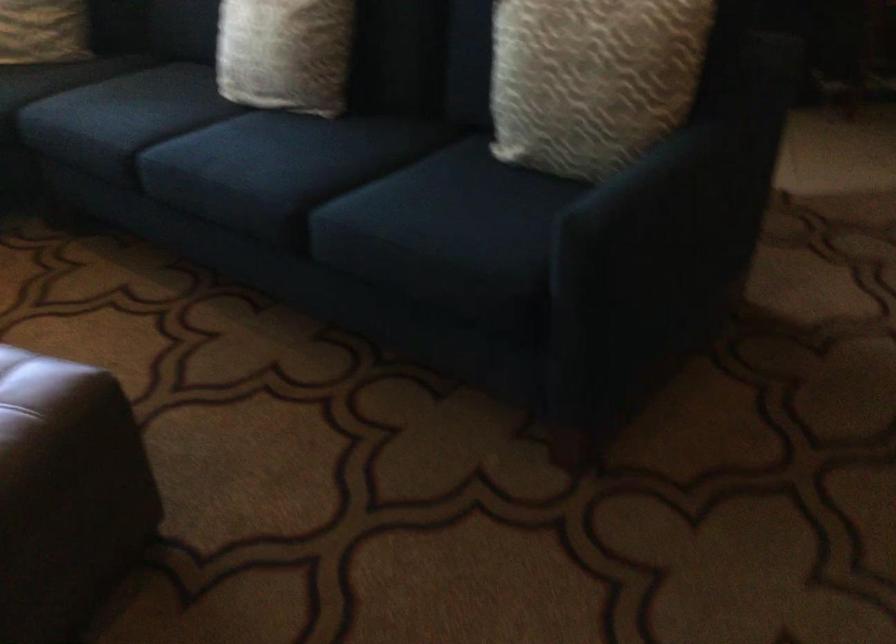
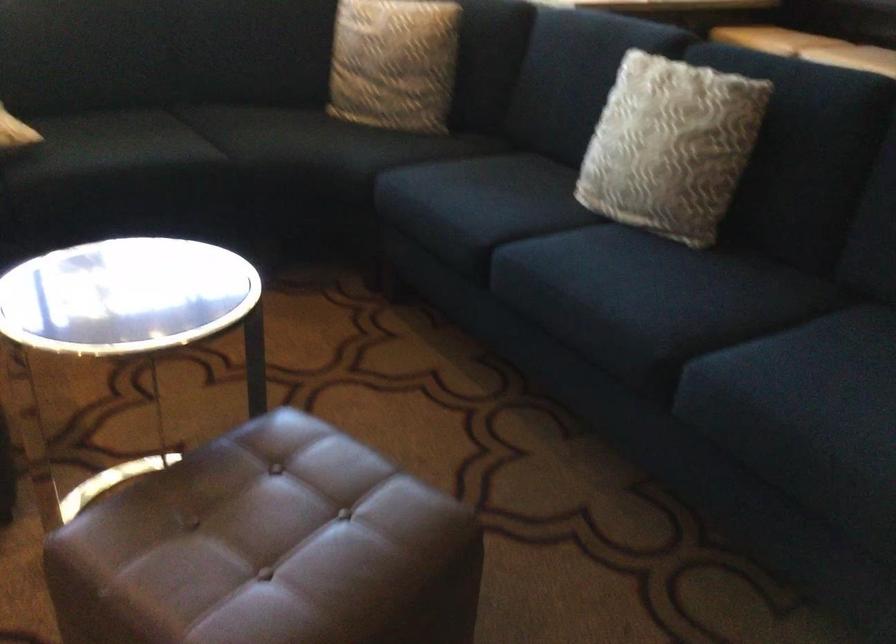
In a continuous first-person perspective shot, in which direction is the camera moving?

The movement direction of the cameraman is left, forward.